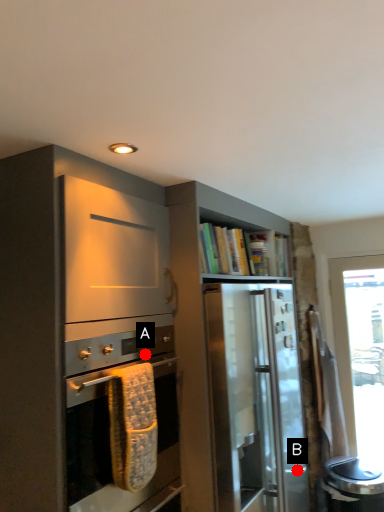
Question: Two points are circled on the image, labeled by A and B beside each circle. Which point is farther to the camera?

Choices:
 (A) A is further
 (B) B is further

Answer: (B)